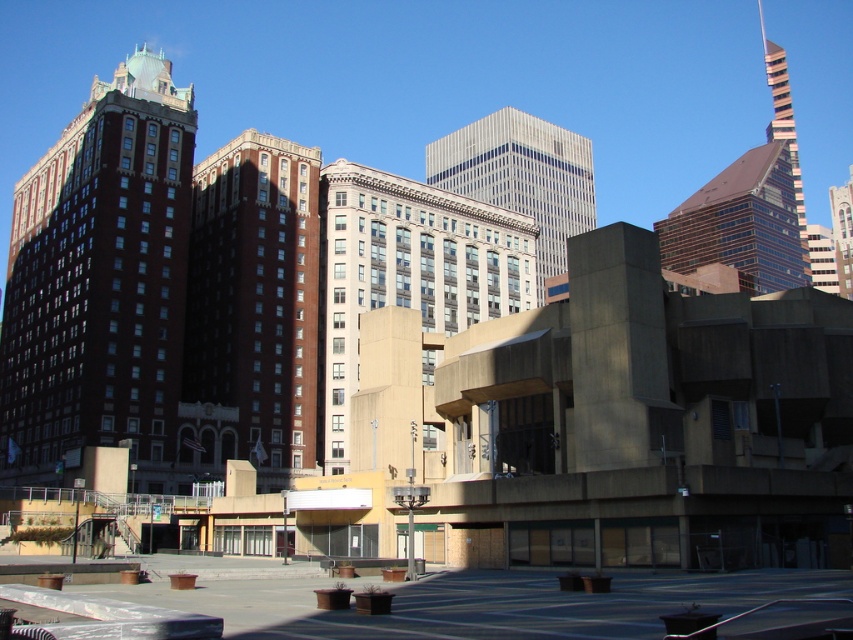
Who is more distant from viewer, (308, 380) or (770, 68)?

The point (770, 68) is more distant.

Between point (267, 276) and point (763, 26), which one is positioned in front?

Point (267, 276) is more forward.

Where is `brown brick building at center`? The image size is (853, 640). brown brick building at center is located at coordinates (256, 298).

Does brown brick building at center have a larger size compared to white glass building at center?

No, brown brick building at center is not bigger than white glass building at center.

Where is `brown brick building at center`? This screenshot has width=853, height=640. brown brick building at center is located at coordinates (256, 298).

Which is behind, point (137, 92) or point (561, 140)?

The point (561, 140) is behind.

Which of these two, brick building at left or white glass skyscraper at center, stands shorter?

With less height is brick building at left.

At what (x,y) coordinates should I click in order to perform the action: click on brick building at left. Please return your answer as a coordinate pair (x, y). The image size is (853, 640). Looking at the image, I should click on (99, 280).